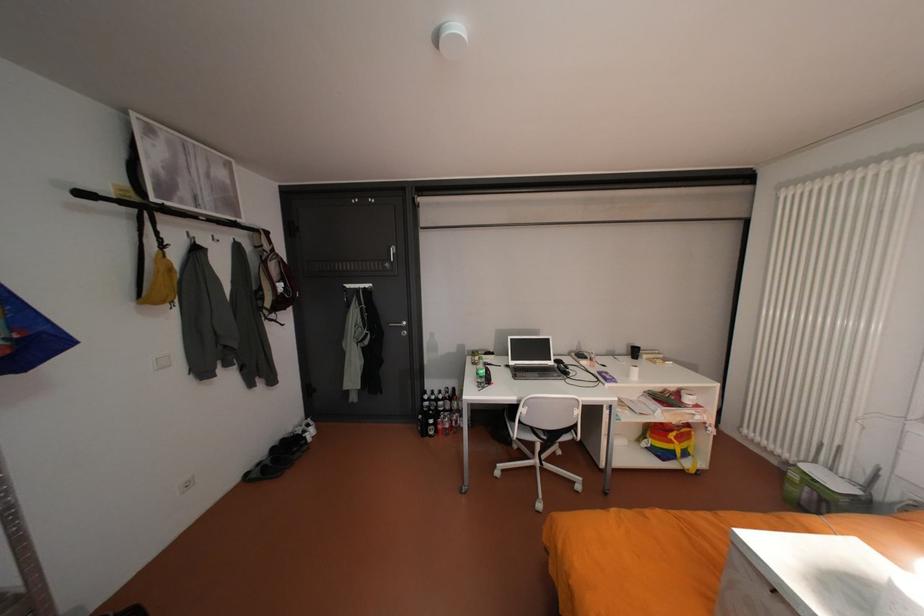
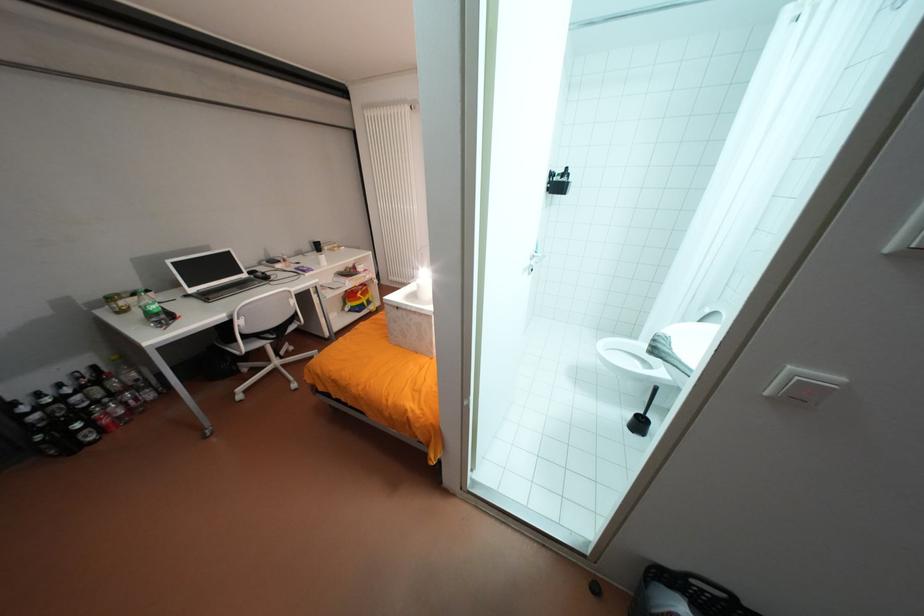
Locate, in the second image, the point that corresponds to pixel 517 371 in the first image.

(203, 302)